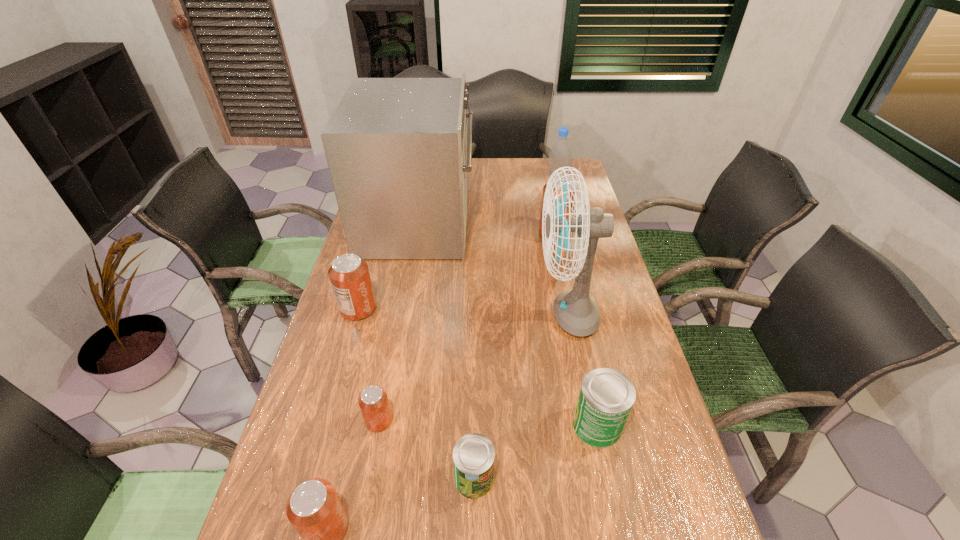
The height and width of the screenshot is (540, 960). I want to click on the smaller green can, so click(473, 455).

Identify the location of the second nearest object. (473, 455).

Identify the location of the smallest orange can. (373, 402).

Identify the location of free spot located 0.090m on the front panel of the toaster oven. (497, 222).

You are a GUI agent. You are given a task and a screenshot of the screen. Output one action in this format:
    pyautogui.click(x=<x>, y=<y>)
    Task: Click on the free space located 0.200m on the front-facing side of the fan
    Image resolution: width=960 pixels, height=540 pixels.
    Given the screenshot: What is the action you would take?
    pyautogui.click(x=468, y=314)

Where is `free region located 0.290m on the front-facing side of the fan`? free region located 0.290m on the front-facing side of the fan is located at coordinates (438, 314).

Where is `free location located 0.210m on the front-facing side of the fan`? This screenshot has height=540, width=960. free location located 0.210m on the front-facing side of the fan is located at coordinates (465, 314).

Where is `free space located 0.060m on the front of the gray bottle`? Image resolution: width=960 pixels, height=540 pixels. free space located 0.060m on the front of the gray bottle is located at coordinates pyautogui.click(x=561, y=193).

The image size is (960, 540). Identify the location of vacant space located on the front of the biggest orange can. (564, 267).

Where is `vacant space located on the right of the second tallest can`? vacant space located on the right of the second tallest can is located at coordinates (426, 309).